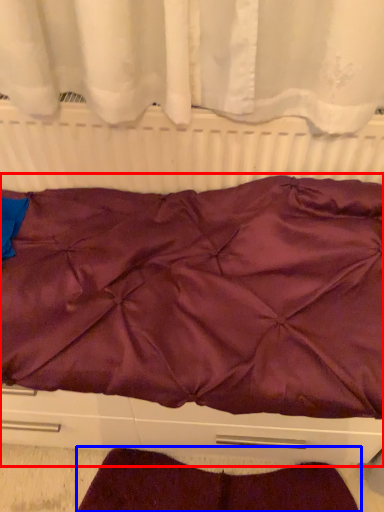
Question: Which of the following is the farthest to the observer, furniture (highlighted by a red box) or blanket (highlighted by a blue box)?

Choices:
 (A) furniture
 (B) blanket

Answer: (B)